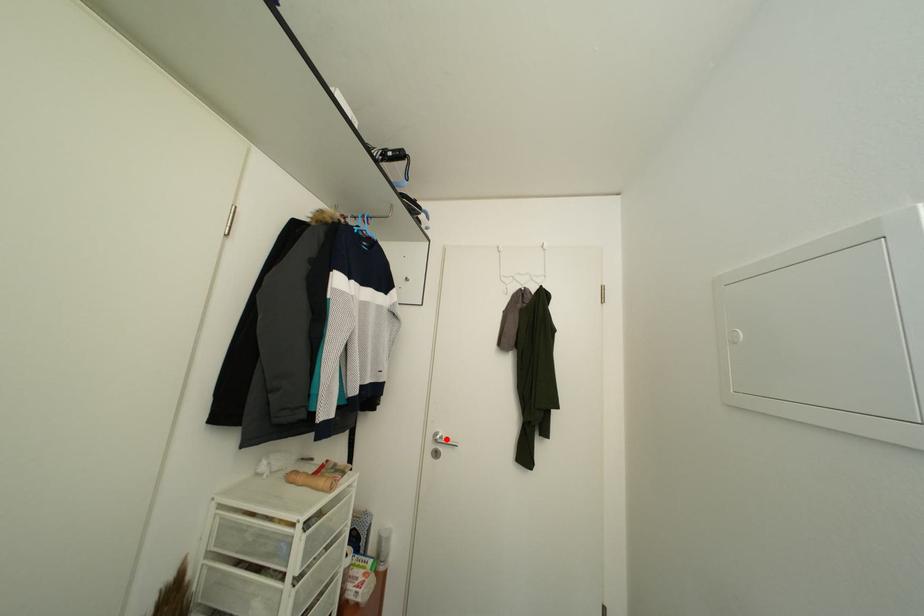
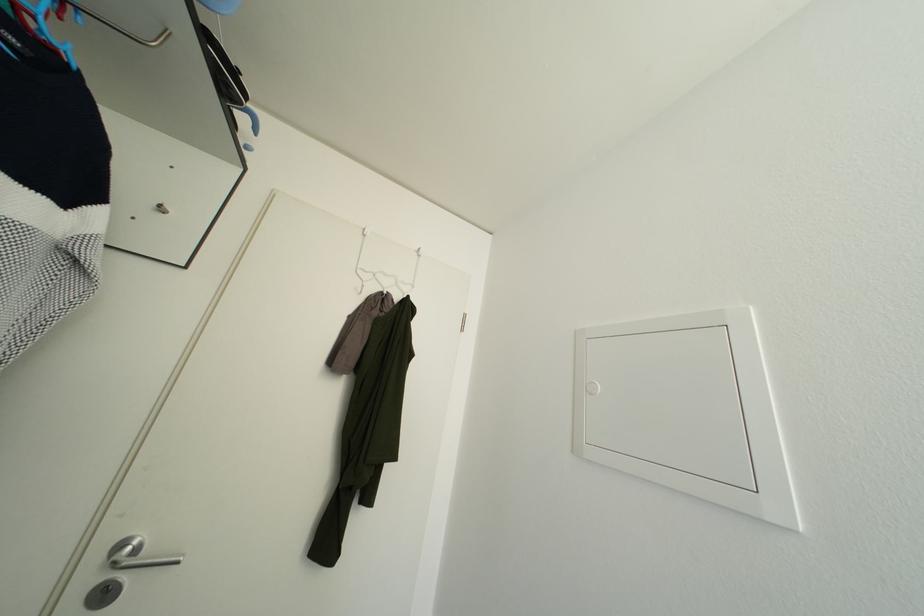
Question: I am providing you with two images of the same scene from different viewpoints. A red point is marked on the first image. At the location where the point appears in image 1, is it still visible in image 2?

Choices:
 (A) Yes
 (B) No

Answer: (A)